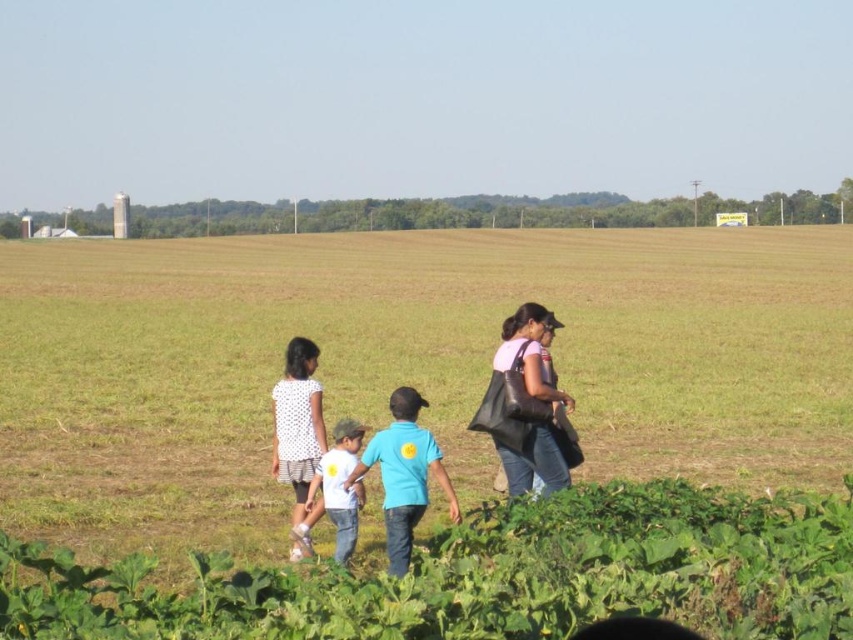
You are a photographer trying to capture a photo of the green grass field at center and the white dotted dress at center. Which object should you focus on first if you want to ensure both are in focus?

The green grass field at center is located above the white dotted dress at center, so you should focus on the green grass field at center first to ensure both are in focus.